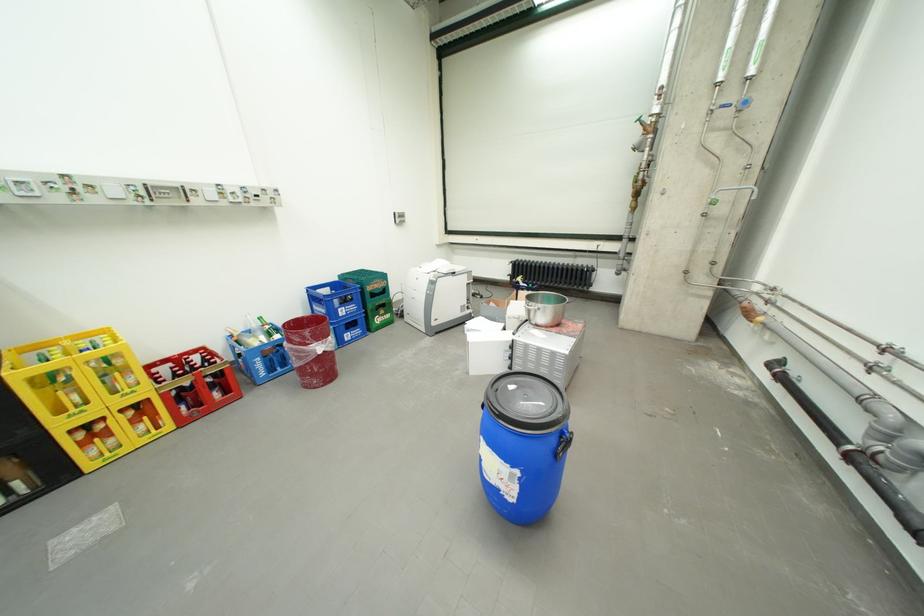
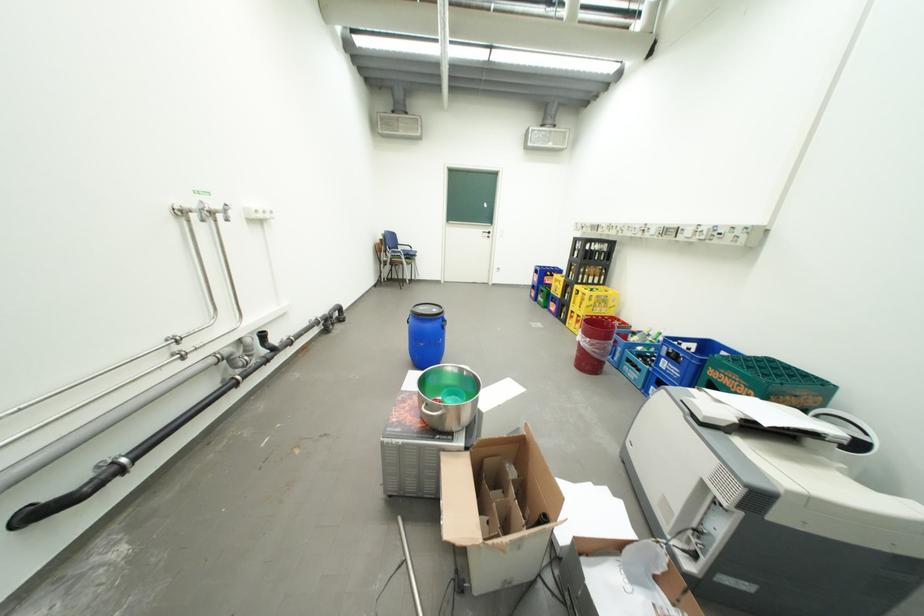
The point at [349,310] is marked in the first image. Where is the corresponding point in the second image?

(674, 361)